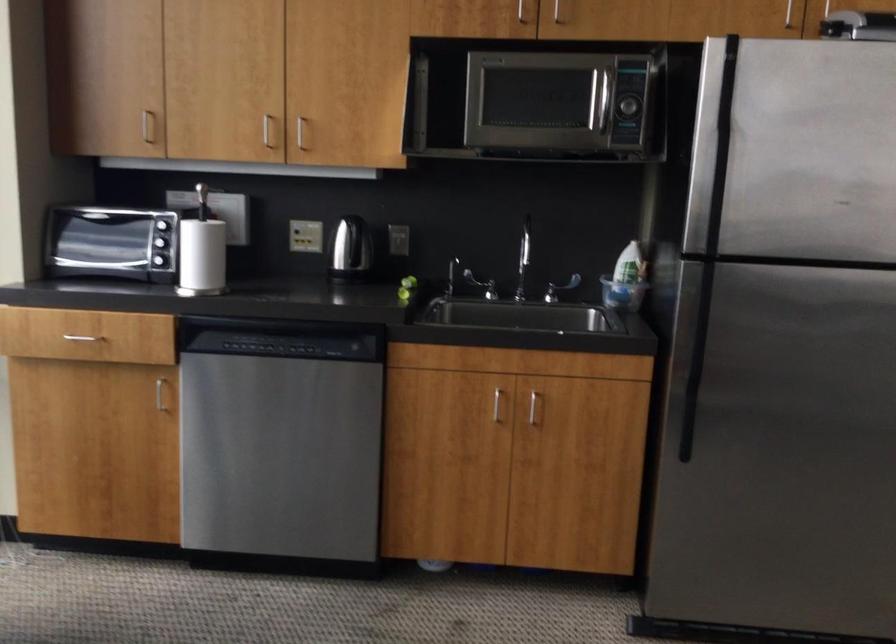
Locate an element on the screen. paper towel holder knob is located at coordinates (202, 281).